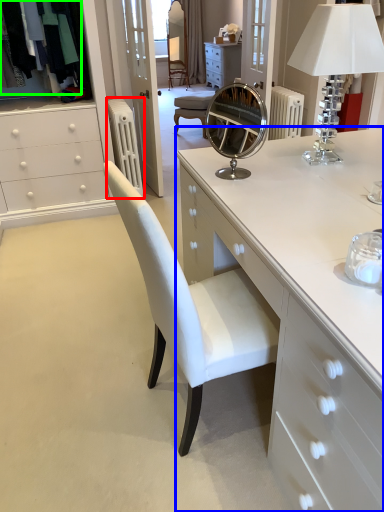
Question: Considering the real-world distances, which object is closest to radiator (highlighted by a red box)? chest of drawers (highlighted by a blue box) or clothing (highlighted by a green box).

Choices:
 (A) chest of drawers
 (B) clothing

Answer: (B)